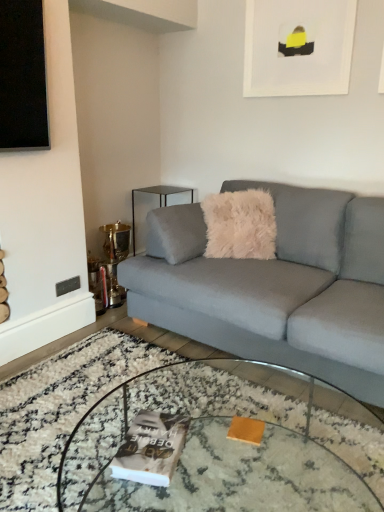
The height and width of the screenshot is (512, 384). I want to click on free space in front of matte gray magazine at center, so click(145, 496).